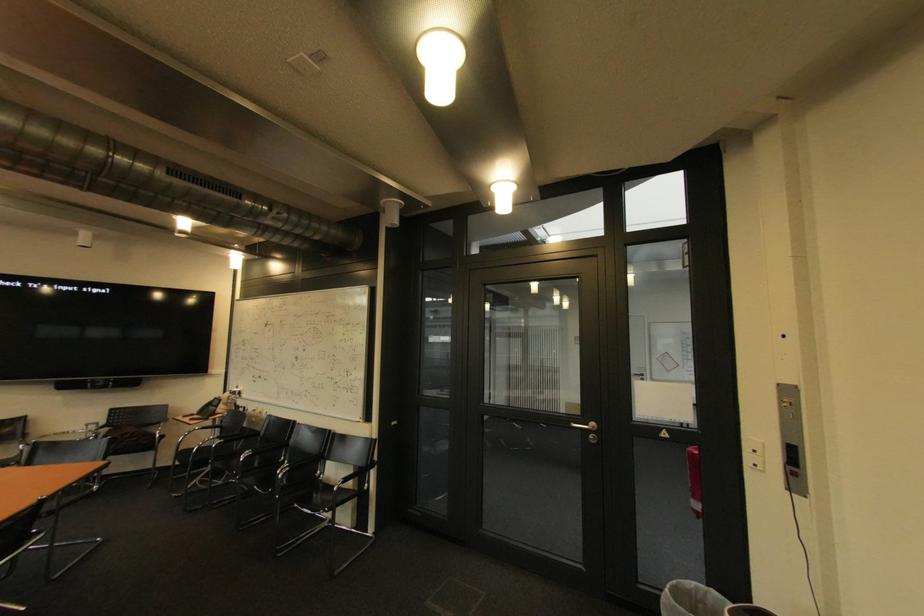
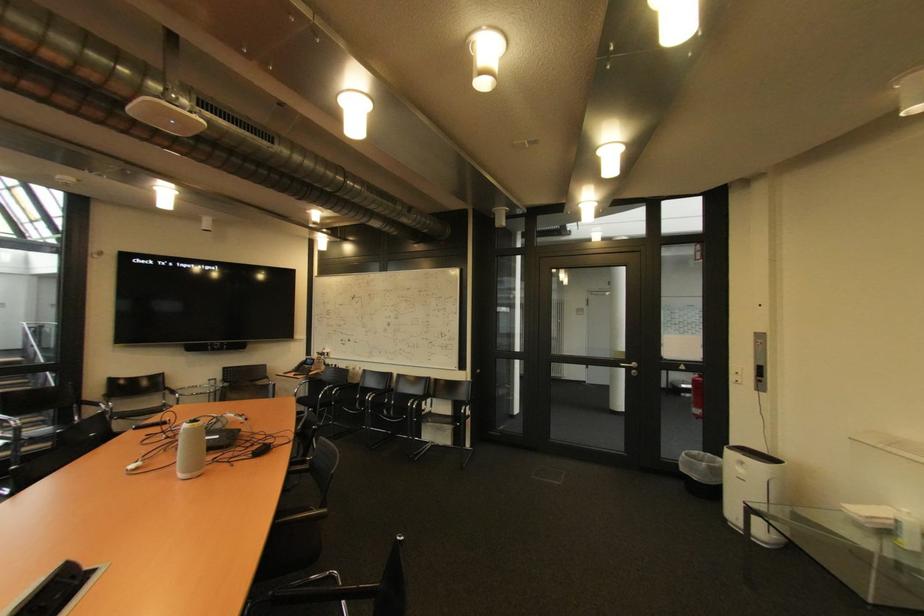
From the picture: What movement of the cameraman would produce the second image?

The cameraman moved toward left, backward.